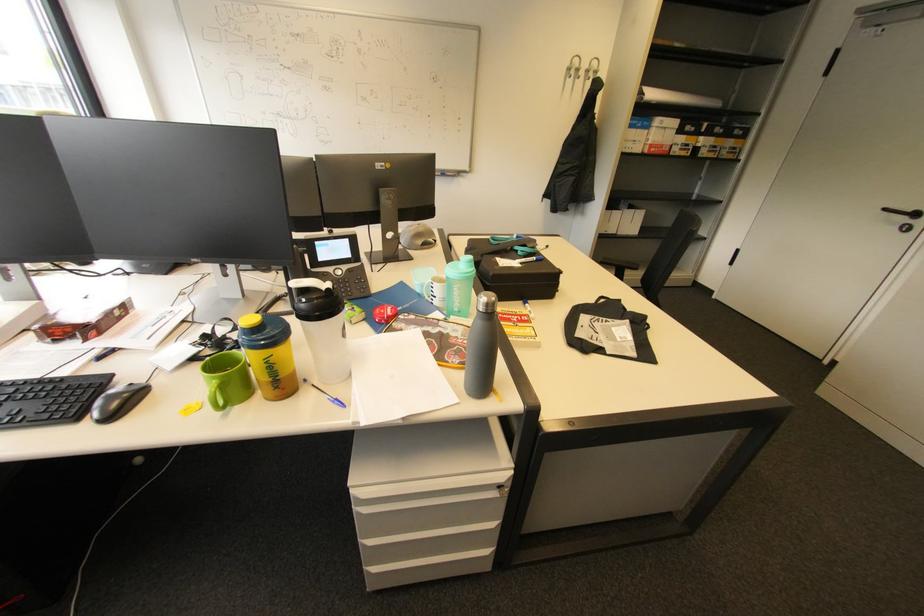
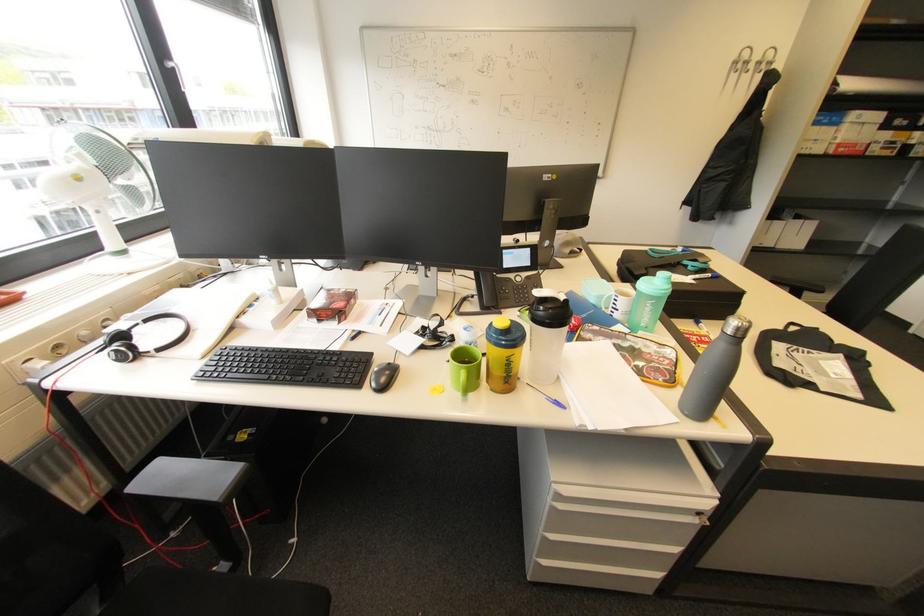
Find the pixel in the second image that matches [374,546] in the first image.

(555, 540)